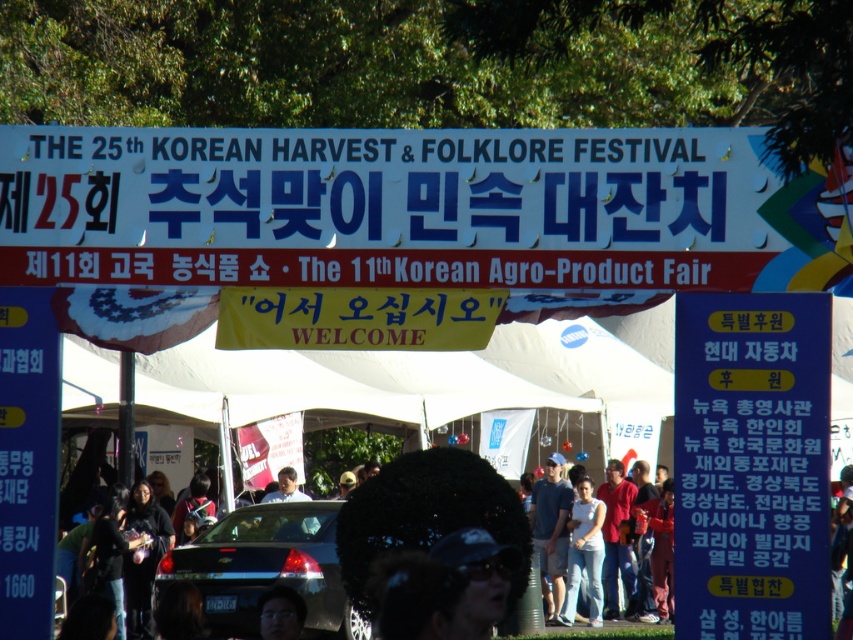
Does blue paper sign at center have a lesser width compared to blue denim jeans at center?

No, blue paper sign at center is not thinner than blue denim jeans at center.

Is point (724, 403) farther from camera compared to point (543, 500)?

That is False.

This screenshot has height=640, width=853. I want to click on blue paper sign at center, so click(751, 465).

Which is above, blue paper sign at center or blue plastic sign at left?

blue plastic sign at left is above.

Between blue paper sign at center and blue plastic sign at left, which one has more height?

Standing taller between the two is blue plastic sign at left.

Does point (769, 531) come in front of point (53, 436)?

Yes, it is.

The image size is (853, 640). Identify the location of blue paper sign at center. (751, 465).

Is blue paper sign at center taller than white cotton shirt at center?

Incorrect, blue paper sign at center's height is not larger of white cotton shirt at center's.

Describe the element at coordinates (751, 465) in the screenshot. I see `blue paper sign at center` at that location.

Which is in front, point (817, 317) or point (572, 536)?

Point (817, 317)

At what (x,y) coordinates should I click in order to perform the action: click on blue paper sign at center. Please return your answer as a coordinate pair (x, y). This screenshot has height=640, width=853. Looking at the image, I should click on (751, 465).